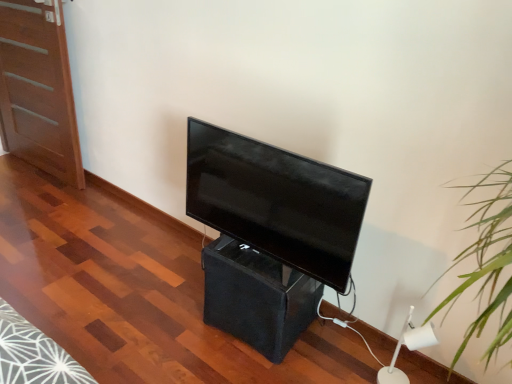
Question: Does matte wood door at left lie in front of matte black tv at center?

Choices:
 (A) no
 (B) yes

Answer: (A)

Question: Is matte wood door at left bigger than matte black tv at center?

Choices:
 (A) yes
 (B) no

Answer: (A)

Question: Considering the relative sizes of matte wood door at left and matte black tv at center in the image provided, is matte wood door at left wider than matte black tv at center?

Choices:
 (A) yes
 (B) no

Answer: (B)

Question: Is matte wood door at left with matte black tv at center?

Choices:
 (A) no
 (B) yes

Answer: (A)

Question: Is matte wood door at left positioned behind matte black tv at center?

Choices:
 (A) yes
 (B) no

Answer: (A)

Question: Is matte wood door at left at the right side of matte black tv at center?

Choices:
 (A) no
 (B) yes

Answer: (A)

Question: Does matte black tv at center have a greater height compared to white plastic lamp at lower right?

Choices:
 (A) no
 (B) yes

Answer: (B)

Question: Is matte black tv at center to the right of white plastic lamp at lower right from the viewer's perspective?

Choices:
 (A) no
 (B) yes

Answer: (A)

Question: From the image's perspective, is matte black tv at center under white plastic lamp at lower right?

Choices:
 (A) no
 (B) yes

Answer: (A)

Question: From a real-world perspective, is matte black tv at center under white plastic lamp at lower right?

Choices:
 (A) no
 (B) yes

Answer: (A)

Question: Can you confirm if matte black tv at center is positioned to the left of white plastic lamp at lower right?

Choices:
 (A) yes
 (B) no

Answer: (A)

Question: From the image's perspective, is matte black tv at center on top of white plastic lamp at lower right?

Choices:
 (A) yes
 (B) no

Answer: (A)

Question: Can you confirm if matte black tv at center is thinner than black fabric speaker at center?

Choices:
 (A) no
 (B) yes

Answer: (B)